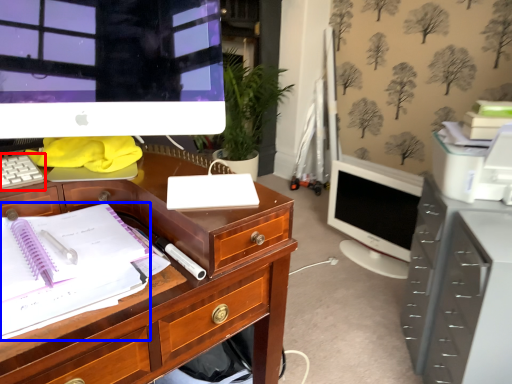
Question: Which object is further to the camera taking this photo, computer keyboard (highlighted by a red box) or office supplies (highlighted by a blue box)?

Choices:
 (A) computer keyboard
 (B) office supplies

Answer: (A)